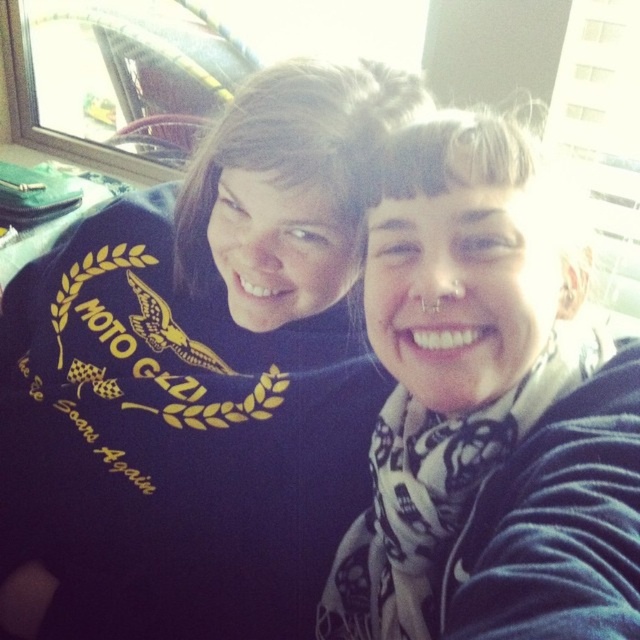
Between dark blue sweatshirt at upper center and white scarf at center, which one is positioned higher?

dark blue sweatshirt at upper center is above.

What do you see at coordinates (198, 380) in the screenshot?
I see `dark blue sweatshirt at upper center` at bounding box center [198, 380].

Image resolution: width=640 pixels, height=640 pixels. I want to click on dark blue sweatshirt at upper center, so click(198, 380).